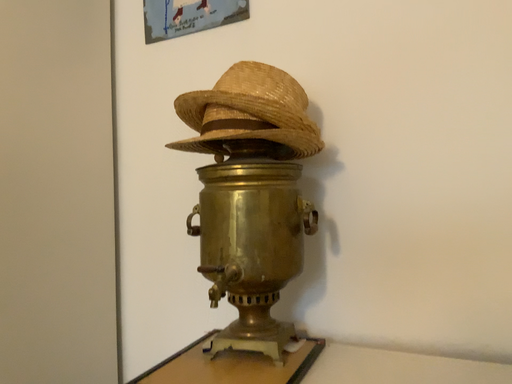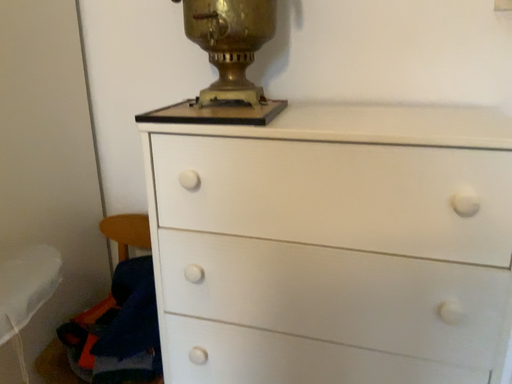
Question: Which way did the camera rotate in the video?

Choices:
 (A) rotated right
 (B) rotated left

Answer: (A)